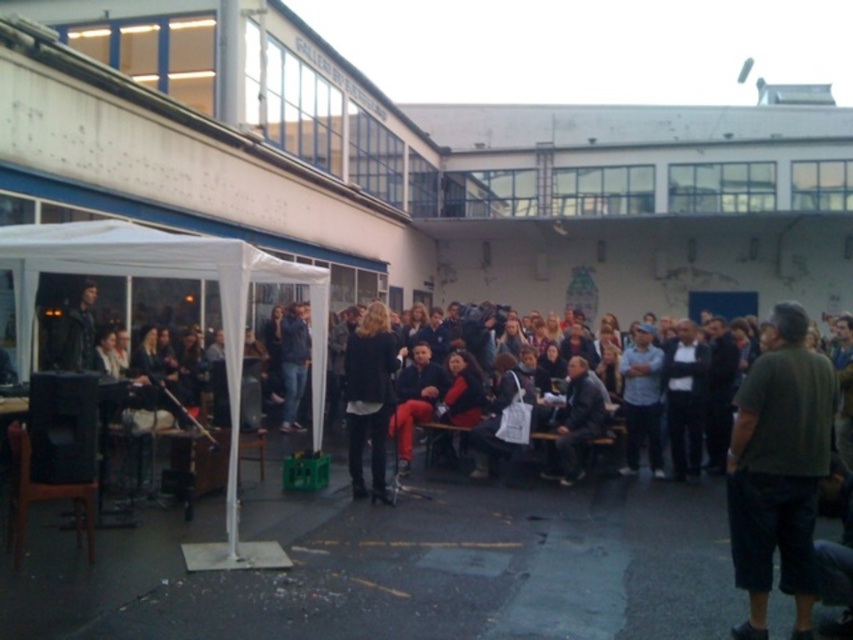
Question: Which point is closer to the camera?

Choices:
 (A) white fabric canopy at left
 (B) matte gray shirt at center

Answer: (A)

Question: Does dark green shirt at right appear under matte gray shirt at center?

Choices:
 (A) no
 (B) yes

Answer: (A)

Question: Among these objects, which one is nearest to the camera?

Choices:
 (A) dark gray suit at center
 (B) white fabric canopy at left
 (C) black leather jacket at center

Answer: (B)

Question: Does black leather jacket at center appear under matte gray shirt at center?

Choices:
 (A) yes
 (B) no

Answer: (A)

Question: Which of the following is the farthest from the observer?

Choices:
 (A) dark green shirt at right
 (B) matte gray shirt at center
 (C) white fabric canopy at left
 (D) dark gray suit at center

Answer: (B)

Question: Observing the image, what is the correct spatial positioning of white fabric canopy at left in reference to matte gray shirt at center?

Choices:
 (A) above
 (B) below

Answer: (A)